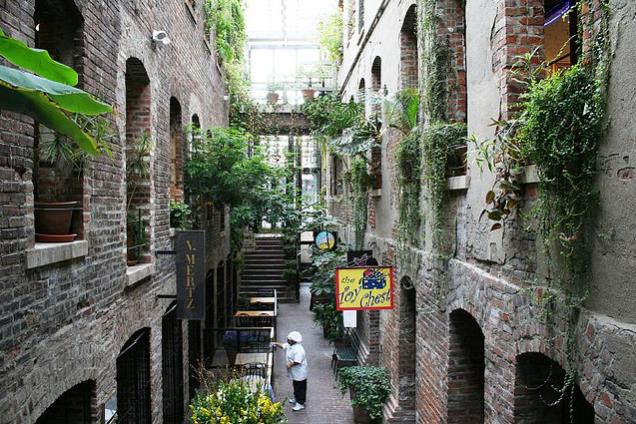
Identify the location of places for sitting. (240, 318), (266, 321), (257, 303), (343, 355), (252, 372), (254, 347).